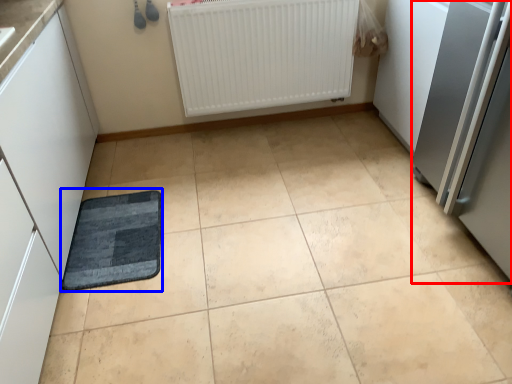
Question: Which object is further to the camera taking this photo, appliance (highlighted by a red box) or mat (highlighted by a blue box)?

Choices:
 (A) appliance
 (B) mat

Answer: (B)